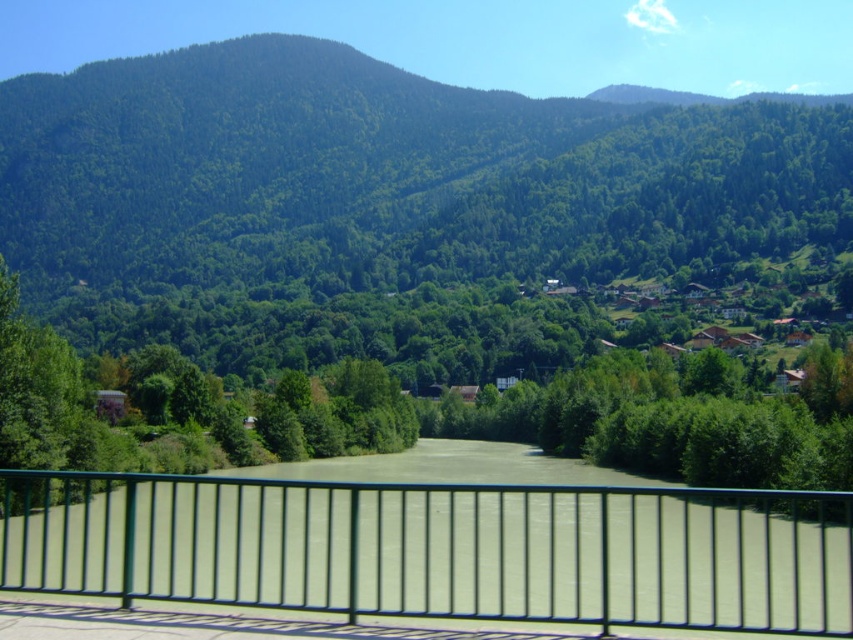
How much distance is there between black metal fence at center and green leafy tree at center?

black metal fence at center and green leafy tree at center are 212.29 feet apart from each other.

Consider the image. Does black metal fence at center have a greater width compared to green leafy tree at center?

No.

I want to click on black metal fence at center, so click(x=438, y=548).

Is green forested mountain at upper center below green leafy tree at center?

No.

Who is more forward, (x=138, y=125) or (x=13, y=365)?

Point (x=13, y=365)

Where is `green forested mountain at upper center`? green forested mountain at upper center is located at coordinates (378, 182).

Is green forested mountain at upper center above black metal fence at center?

Yes.

Is green forested mountain at upper center smaller than black metal fence at center?

Incorrect, green forested mountain at upper center is not smaller in size than black metal fence at center.

Identify the location of green forested mountain at upper center. The height and width of the screenshot is (640, 853). (378, 182).